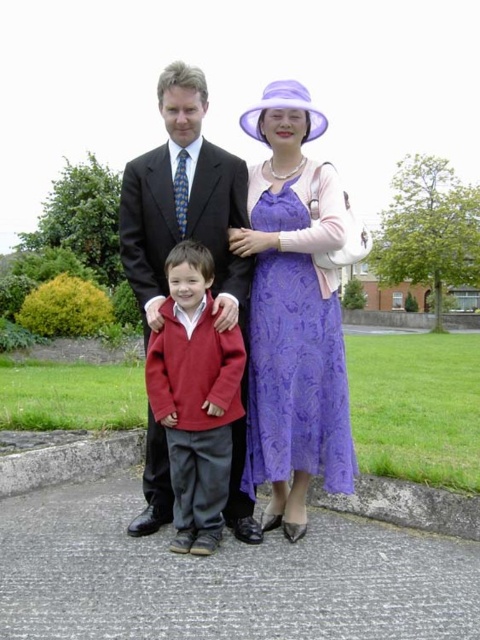
Question: Which point is farther to the camera?

Choices:
 (A) matte red sweater at center
 (B) purple lace dress at center
 (C) matte black suit at center

Answer: (B)

Question: Which point appears farthest from the camera in this image?

Choices:
 (A) (142, 202)
 (B) (169, 472)

Answer: (A)

Question: Estimate the real-world distances between objects in this image. Which object is closer to the matte red sweater at center?

Choices:
 (A) matte black suit at center
 (B) purple lace dress at center

Answer: (A)

Question: Is matte black suit at center wider than matte red sweater at center?

Choices:
 (A) no
 (B) yes

Answer: (B)

Question: Is matte black suit at center behind matte red sweater at center?

Choices:
 (A) yes
 (B) no

Answer: (A)

Question: Does purple lace dress at center have a smaller size compared to matte black suit at center?

Choices:
 (A) no
 (B) yes

Answer: (B)